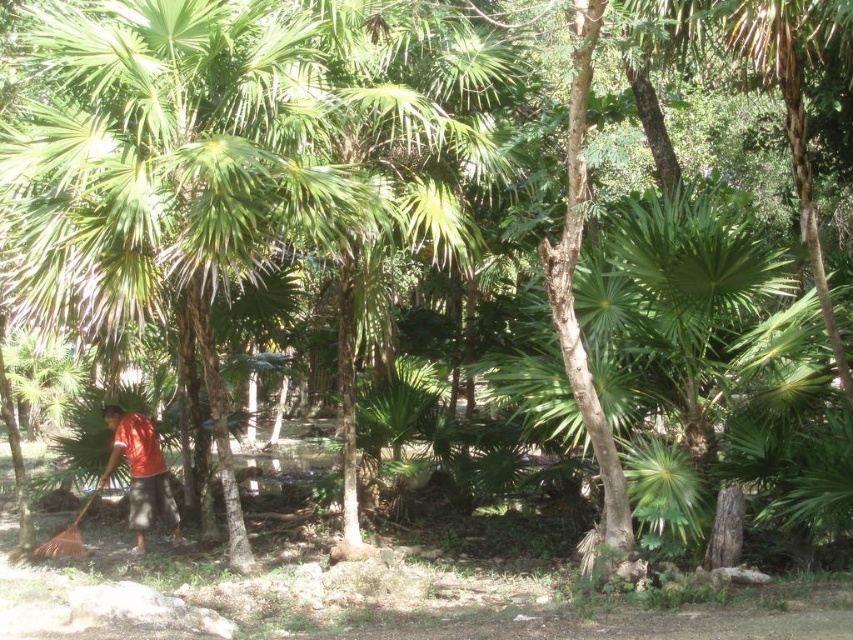
You are standing in a tropical forest and see a point at coordinates (x=140, y=472). What object is this point located on?

The point at coordinates (x=140, y=472) is located on the orange fabric shirt at lower left.

You are standing in a tropical garden and see an orange fabric shirt at lower left and a brown wooden shovel at lower left. Which object is more to the right?

The orange fabric shirt at lower left is more to the right than the brown wooden shovel at lower left.